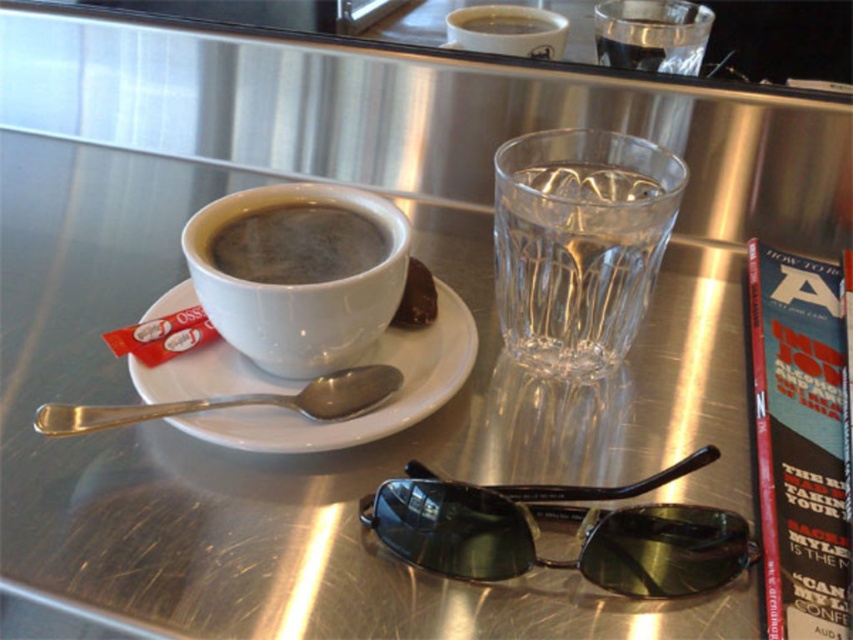
Question: Which point is farther to the camera?

Choices:
 (A) white ceramic saucer at center
 (B) clear glass water at center

Answer: (B)

Question: Which of the following is the closest to the observer?

Choices:
 (A) black plastic goggles at lower center
 (B) silver metallic spoon at upper center

Answer: (A)

Question: Does clear glass water at center appear on the left side of black matte cup at upper center?

Choices:
 (A) no
 (B) yes

Answer: (A)

Question: Which of the following is the closest to the observer?

Choices:
 (A) metallic silver tray at upper center
 (B) clear glass water at center
 (C) white ceramic saucer at center

Answer: (A)

Question: Is white ceramic saucer at center positioned behind silver metallic spoon at upper center?

Choices:
 (A) no
 (B) yes

Answer: (B)

Question: Can you confirm if black plastic goggles at lower center is wider than black matte cup at upper center?

Choices:
 (A) yes
 (B) no

Answer: (A)